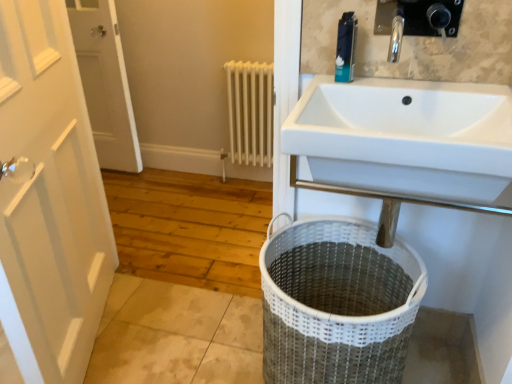
Question: Is blue plastic toothpaste tube at upper center further to the viewer compared to white wooden door at left, the second door in the back-to-front sequence?

Choices:
 (A) no
 (B) yes

Answer: (B)

Question: From a real-world perspective, is blue plastic toothpaste tube at upper center positioned over white wooden door at left, placed as the 1th door when sorted from front to back, based on gravity?

Choices:
 (A) yes
 (B) no

Answer: (A)

Question: Is blue plastic toothpaste tube at upper center shorter than white wooden door at left, the second door in the back-to-front sequence?

Choices:
 (A) no
 (B) yes

Answer: (B)

Question: Is white wooden door at left, arranged as the 2th door when viewed from the left, completely or partially inside blue plastic toothpaste tube at upper center?

Choices:
 (A) no
 (B) yes

Answer: (A)

Question: Is blue plastic toothpaste tube at upper center positioned far away from white wooden door at left, placed as the 1th door when sorted from front to back?

Choices:
 (A) no
 (B) yes

Answer: (A)

Question: From a real-world perspective, relative to white woven laundry basket at lower center, is white wooden door at left, marked as the 2th door in a right-to-left arrangement, vertically above or below?

Choices:
 (A) below
 (B) above

Answer: (B)

Question: Is white wooden door at left, which is counted as the second door, starting from the front, wider or thinner than white woven laundry basket at lower center?

Choices:
 (A) wide
 (B) thin

Answer: (B)

Question: In the image, is white wooden door at left, placed as the first door when sorted from back to front, positioned in front of or behind white woven laundry basket at lower center?

Choices:
 (A) behind
 (B) front

Answer: (A)

Question: From the image's perspective, relative to white woven laundry basket at lower center, is white wooden door at left, the first door in the left-to-right sequence, above or below?

Choices:
 (A) below
 (B) above

Answer: (B)

Question: Is white woven laundry basket at lower center bigger or smaller than white wooden door at left, the first door in the left-to-right sequence?

Choices:
 (A) small
 (B) big

Answer: (B)

Question: In the image, is white woven laundry basket at lower center positioned in front of or behind white wooden door at left, marked as the 2th door in a right-to-left arrangement?

Choices:
 (A) behind
 (B) front

Answer: (B)

Question: In the image, is white woven laundry basket at lower center on the left side or the right side of white wooden door at left, which is counted as the second door, starting from the front?

Choices:
 (A) right
 (B) left

Answer: (A)

Question: In terms of width, does white woven laundry basket at lower center look wider or thinner when compared to white wooden door at left, marked as the 2th door in a right-to-left arrangement?

Choices:
 (A) thin
 (B) wide

Answer: (B)

Question: Visually, is blue plastic toothpaste tube at upper center positioned to the left or to the right of white wooden door at left, placed as the first door when sorted from back to front?

Choices:
 (A) right
 (B) left

Answer: (A)

Question: Does point (340, 74) appear closer or farther from the camera than point (83, 51)?

Choices:
 (A) farther
 (B) closer

Answer: (B)